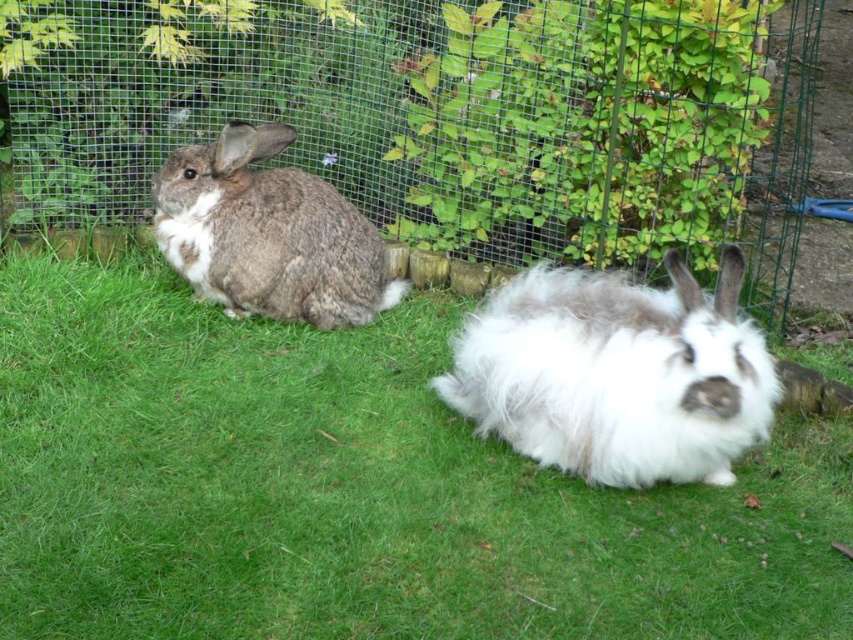
Between green grass at center and fluffy white rabbit at center, which one has more height?

green grass at center is taller.

Which is in front, point (129, 570) or point (483, 369)?

Point (129, 570)

Measure the distance between green grass at center and camera.

green grass at center and camera are 7.43 feet apart.

Find the location of a particular element. green grass at center is located at coordinates (355, 490).

Between green grass at center and gray fluffy rabbit at left, which one has more height?

Standing taller between the two is green grass at center.

Who is higher up, green grass at center or gray fluffy rabbit at left?

gray fluffy rabbit at left is above.

I want to click on green grass at center, so coord(355,490).

Does green grass at center come in front of green wire mesh at center?

Yes, it is.

Can you confirm if green grass at center is taller than green wire mesh at center?

In fact, green grass at center may be shorter than green wire mesh at center.

Image resolution: width=853 pixels, height=640 pixels. What are the coordinates of `green grass at center` in the screenshot? It's located at (355, 490).